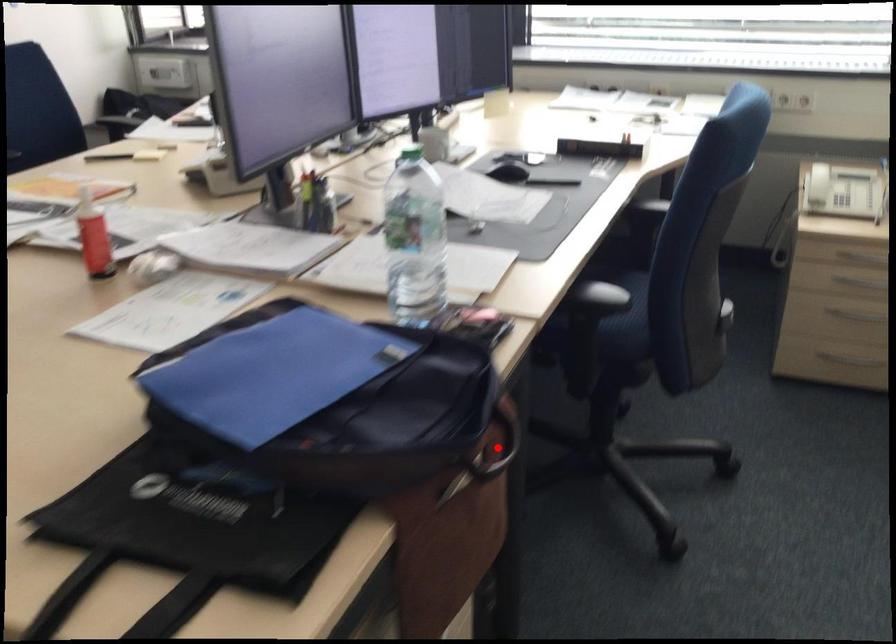
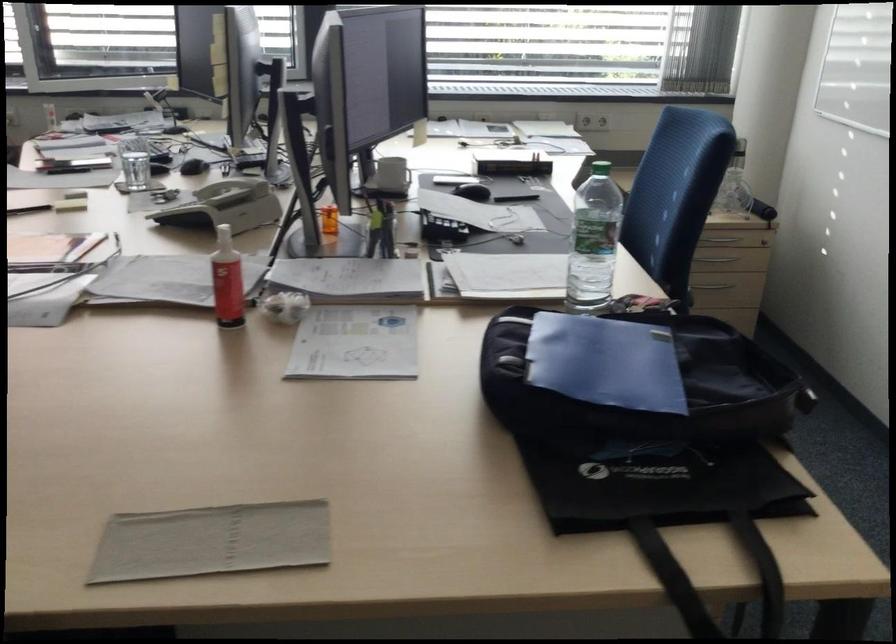
Question: I am providing you with two images of the same scene from different viewpoints. A red point is marked on the first image. Is the red point's position out of view in image 2?

Choices:
 (A) Yes
 (B) No

Answer: (A)